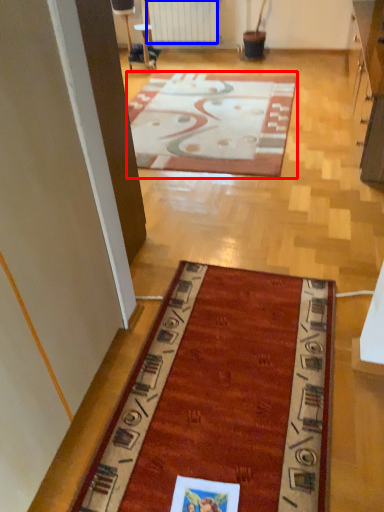
Question: Which object appears closest to the camera in this image, mat (highlighted by a red box) or radiator (highlighted by a blue box)?

Choices:
 (A) mat
 (B) radiator

Answer: (A)